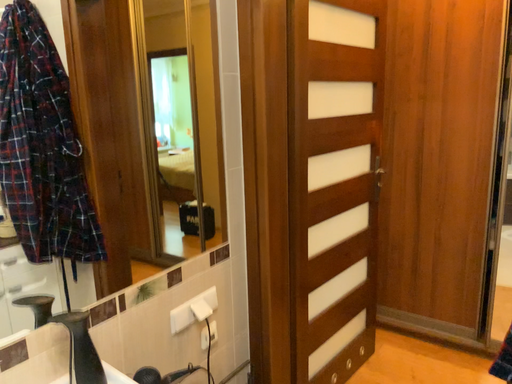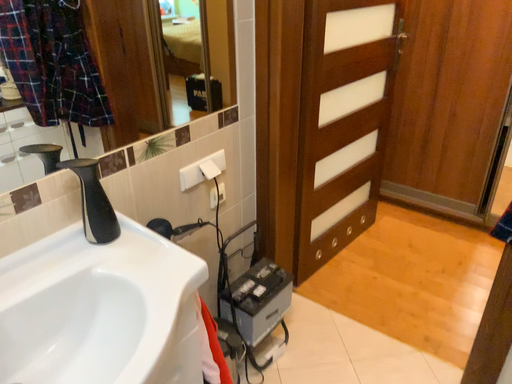
Question: Which way did the camera rotate in the video?

Choices:
 (A) rotated upward
 (B) rotated downward

Answer: (B)